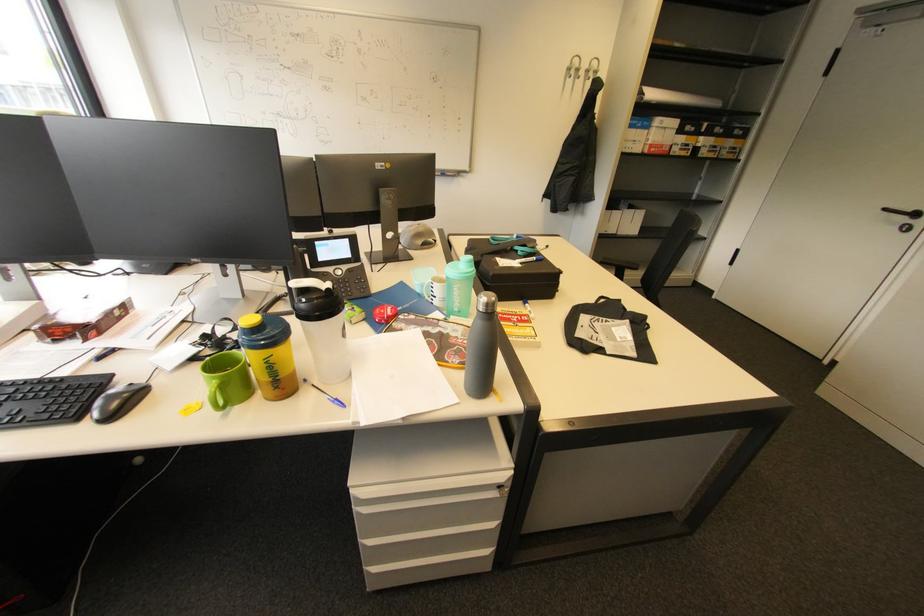
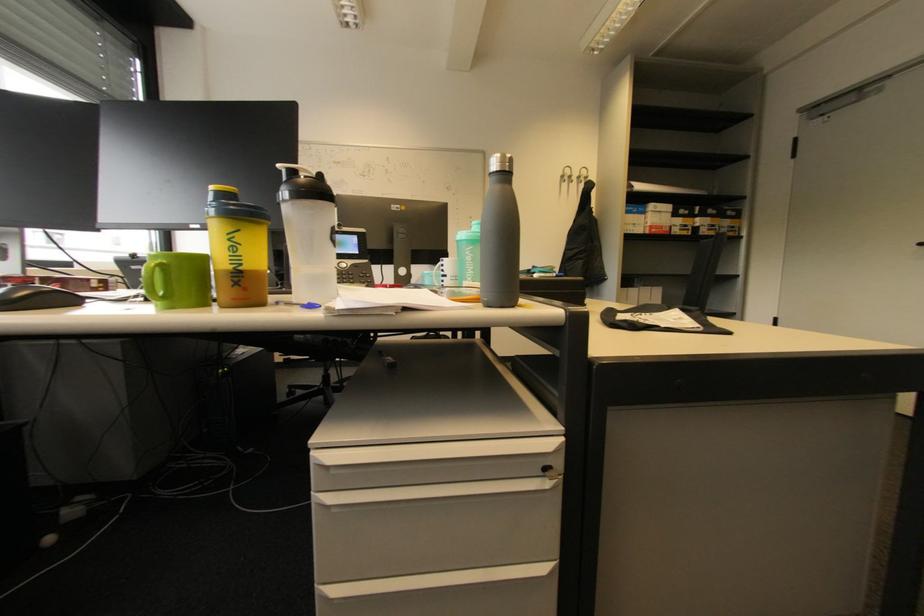
Question: The first image is from the beginning of the video and the second image is from the end. How did the camera likely rotate when shooting the video?

Choices:
 (A) Left
 (B) Right
 (C) Up
 (D) Down

Answer: (C)